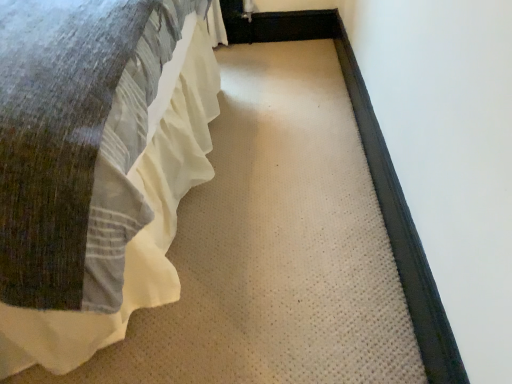
Locate an element on the screen. This screenshot has width=512, height=384. vacant space to the left of black rubber doormat at right is located at coordinates (282, 137).